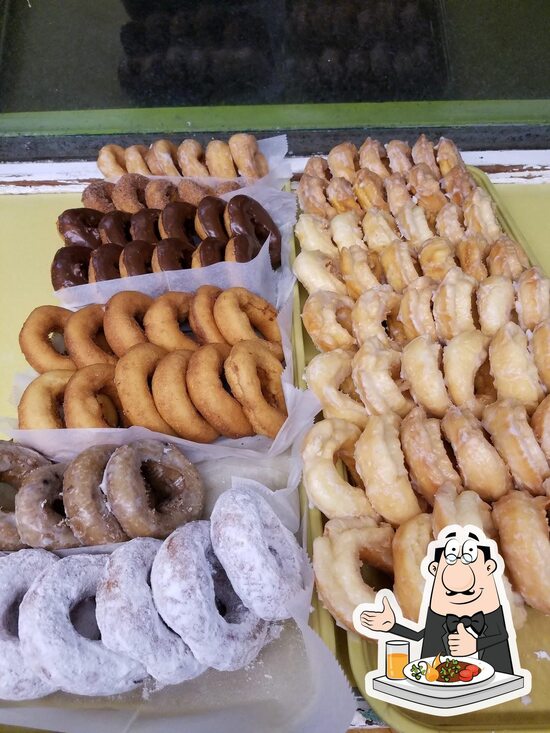
Identify the location of tray. The height and width of the screenshot is (733, 550). (459, 720), (426, 696), (29, 265), (292, 339), (317, 531), (490, 190), (294, 253).